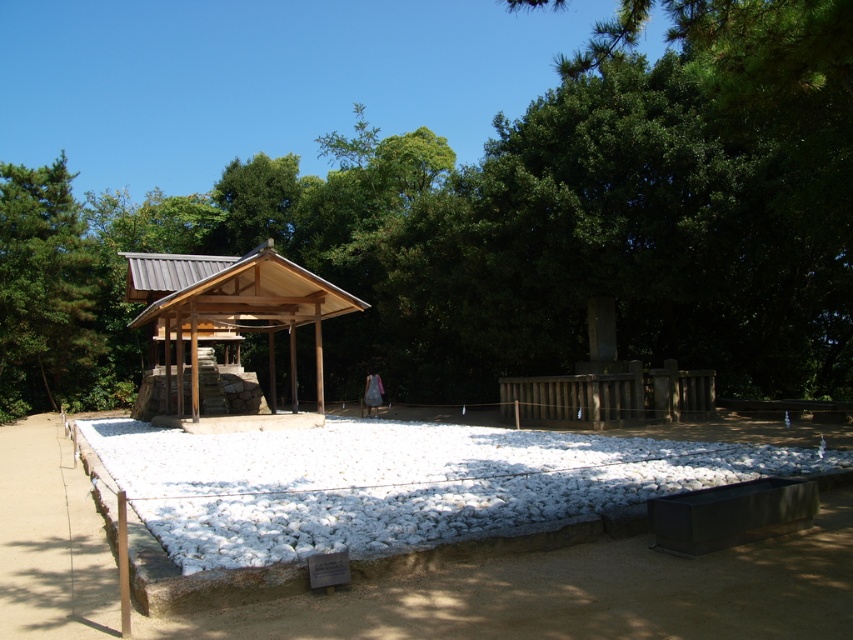
Question: Observing the image, what is the correct spatial positioning of green leafy tree at upper center in reference to wooden gazebo at center?

Choices:
 (A) below
 (B) above

Answer: (B)

Question: Which point appears farthest from the camera in this image?

Choices:
 (A) (155, 342)
 (B) (383, 192)

Answer: (B)

Question: Can you confirm if green leafy tree at upper center is smaller than wooden gazebo at center?

Choices:
 (A) no
 (B) yes

Answer: (A)

Question: Considering the relative positions of green leafy tree at upper center and wooden gazebo at center in the image provided, where is green leafy tree at upper center located with respect to wooden gazebo at center?

Choices:
 (A) right
 (B) left

Answer: (A)

Question: Which point is farther from the camera taking this photo?

Choices:
 (A) (409, 244)
 (B) (148, 372)

Answer: (B)